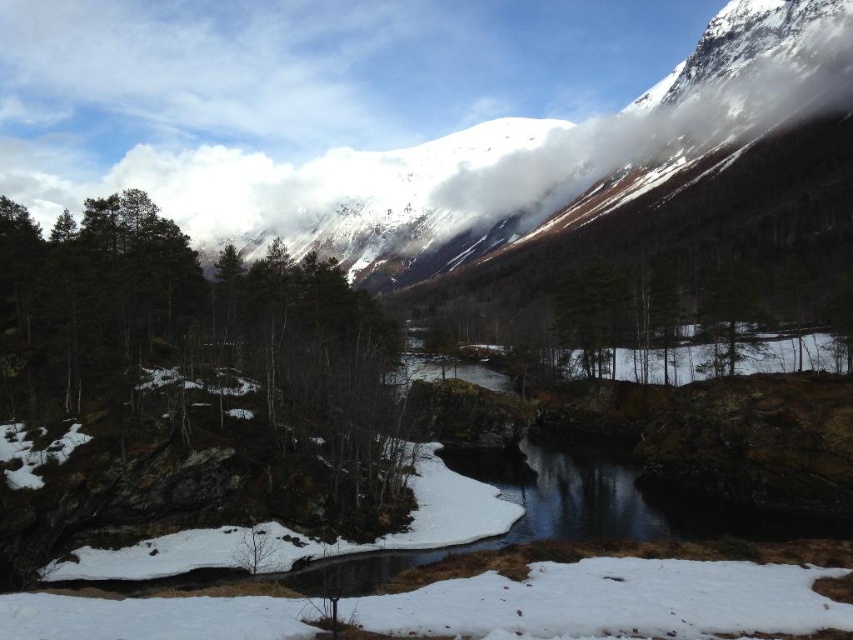
You are planning to take a photo of the green matte tree at center and the white fluffy cloud at upper center. Which object will appear narrower in the photo?

The green matte tree at center will appear narrower in the photo because its width is less than that of the white fluffy cloud at upper center.

You are standing at the point with coordinates (204, 353) in the mountainous landscape. What object is located exactly at your current position?

The green matte tree at center is located exactly at the point with coordinates (204, 353).